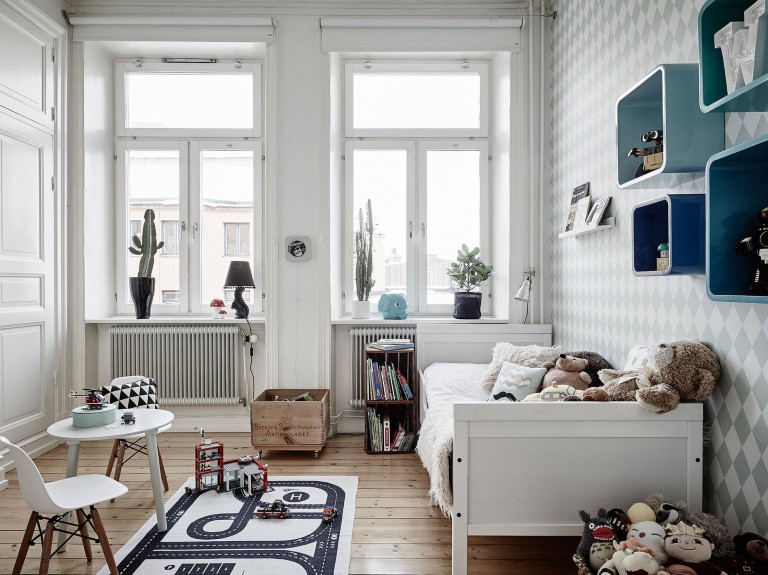
In order to click on white table in this screenshot , I will do `click(150, 426)`.